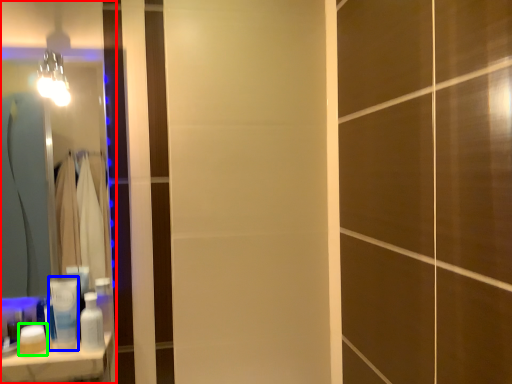
Question: Which is nearer to the mirror (highlighted by a red box)? toiletry (highlighted by a blue box) or toiletry (highlighted by a green box).

Choices:
 (A) toiletry
 (B) toiletry

Answer: (A)